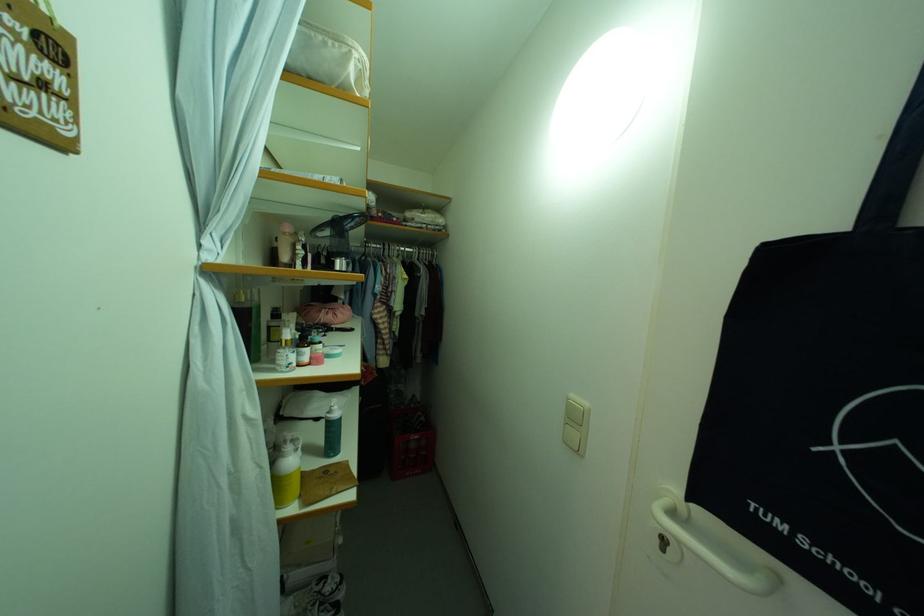
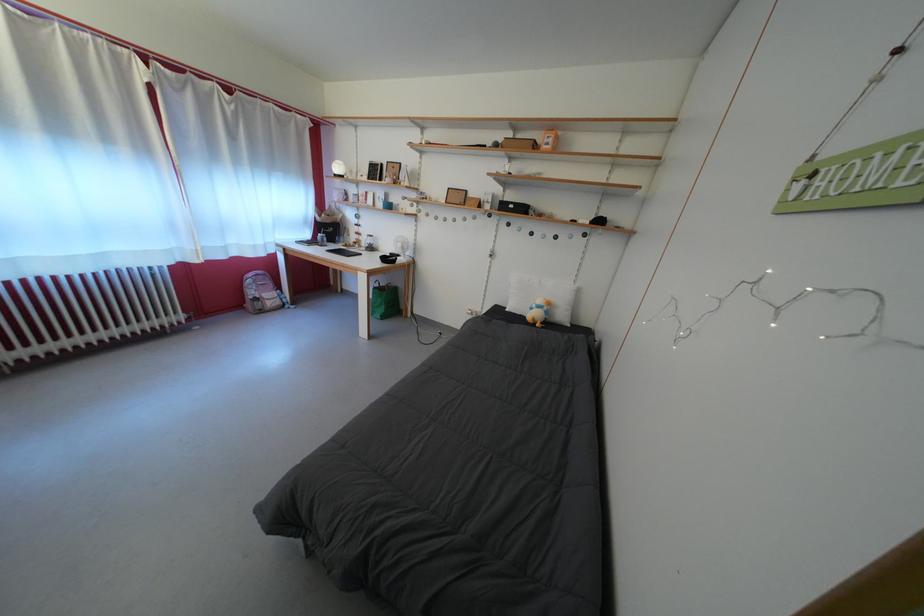
First-person continuous shooting, in which direction is the camera rotating?

The rotation direction of the camera is left-down.